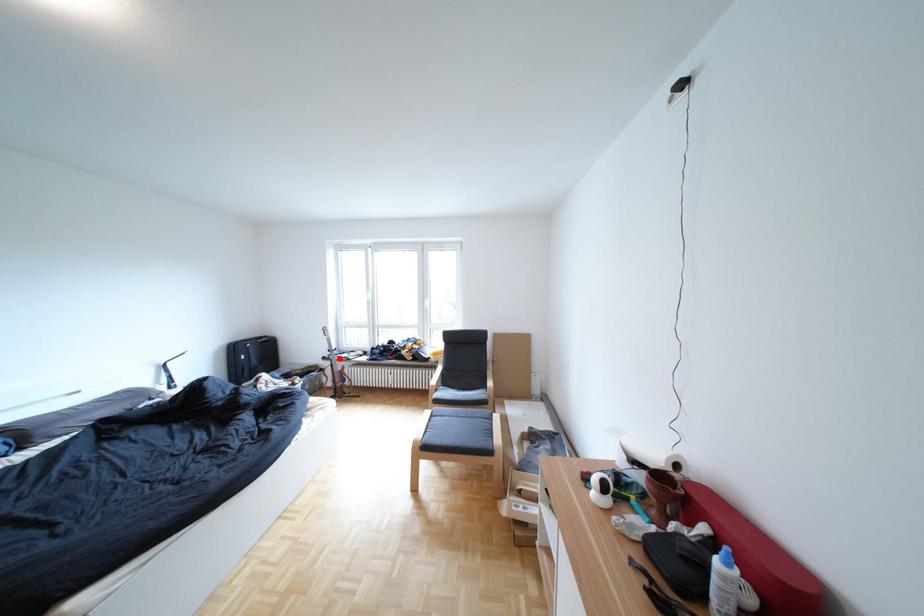
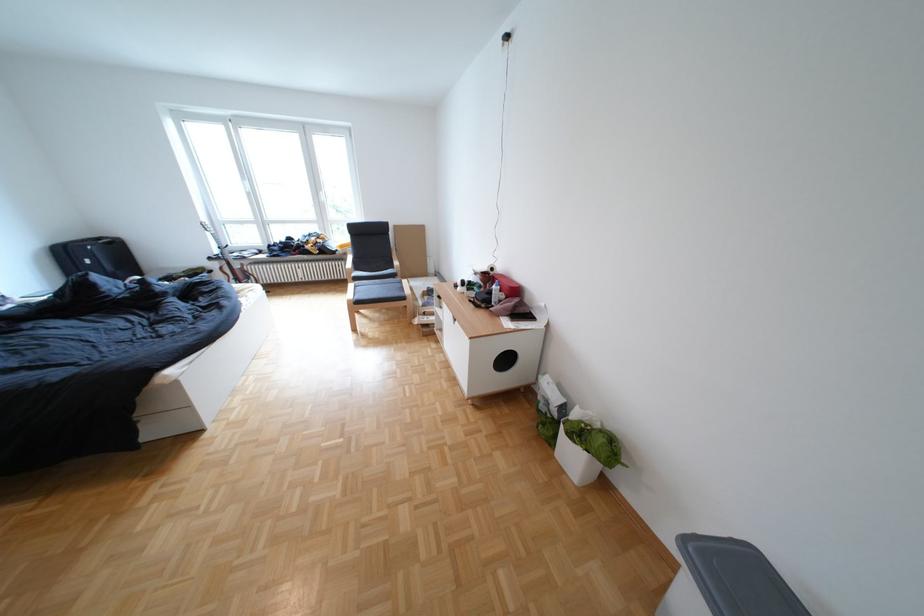
Question: I am providing you with two images of the same scene from different viewpoints. A red point is shown in image1. For the corresponding object point in image2, is it positioned nearer or farther from the camera?

Choices:
 (A) Nearer
 (B) Farther

Answer: (A)